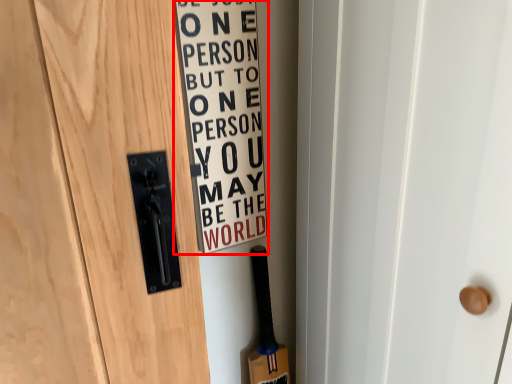
Question: In this image, where is warning sign (annotated by the red box) located relative to baseball bat?

Choices:
 (A) left
 (B) right

Answer: (A)